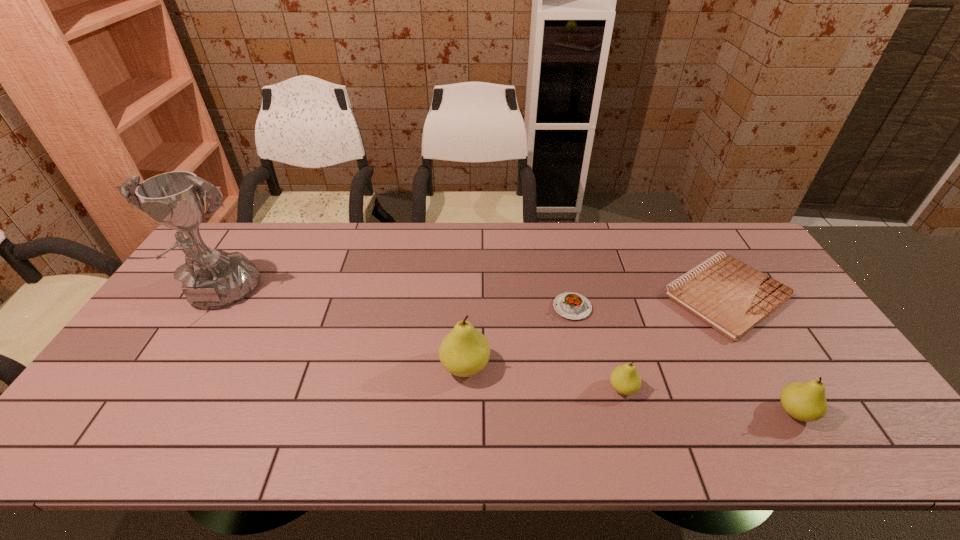
Find the location of a particular element. The width and height of the screenshot is (960, 540). unoccupied position between the tallest pear and the shortest pear is located at coordinates (544, 377).

Locate an element on the screen. This screenshot has height=540, width=960. unoccupied area between the notebook and the shortest pear is located at coordinates (675, 342).

You are a GUI agent. You are given a task and a screenshot of the screen. Output one action in this format:
    pyautogui.click(x=<x>, y=<y>)
    Task: Click on the free point between the fifth object from right to left and the leftmost object
    This screenshot has height=540, width=960.
    Given the screenshot: What is the action you would take?
    pyautogui.click(x=341, y=332)

The width and height of the screenshot is (960, 540). What are the coordinates of `blank region between the tallest object and the fifth object from right to left` in the screenshot? It's located at (341, 332).

Locate an element on the screen. vacant area that lies between the fourth tallest object and the award is located at coordinates 420,343.

Where is `the third closest object to the fifth tallest object`? the third closest object to the fifth tallest object is located at coordinates (732, 297).

Locate which object ranks fourth in proximity to the award. Please provide its 2D coordinates. Your answer should be formatted as a tuple, i.e. [(x, y)], where the tuple contains the x and y coordinates of a point satisfying the conditions above.

[(732, 297)]

Locate which pear ranks in proximity to the leftmost object. Please provide its 2D coordinates. Your answer should be formatted as a tuple, i.e. [(x, y)], where the tuple contains the x and y coordinates of a point satisfying the conditions above.

[(465, 351)]

Select which pear appears as the third closest to the shortest object. Please provide its 2D coordinates. Your answer should be formatted as a tuple, i.e. [(x, y)], where the tuple contains the x and y coordinates of a point satisfying the conditions above.

[(465, 351)]

You are a GUI agent. You are given a task and a screenshot of the screen. Output one action in this format:
    pyautogui.click(x=<x>, y=<y>)
    Task: Click on the free spot that satisfies the following two spatial constraints: 1. on the back side of the second tallest object; 2. on the left side of the notebook
    The image size is (960, 540).
    Given the screenshot: What is the action you would take?
    pyautogui.click(x=468, y=296)